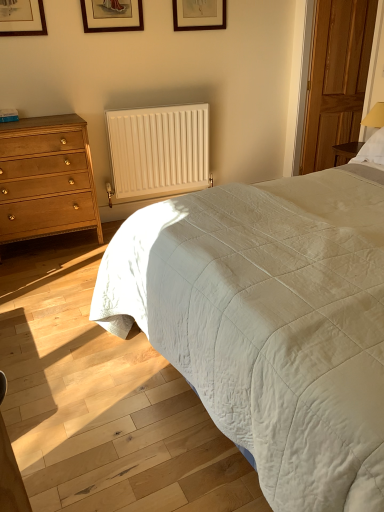
Question: Considering the relative positions of wooden picture frame at upper center, the second picture frame from the front, and wooden picture frame at upper center, which is the 1th picture frame from left to right, in the image provided, is wooden picture frame at upper center, the second picture frame from the front, to the right of wooden picture frame at upper center, which is the 1th picture frame from left to right, from the viewer's perspective?

Choices:
 (A) no
 (B) yes

Answer: (B)

Question: Is wooden picture frame at upper center, which is counted as the 1th picture frame, starting from the right, completely or partially outside of wooden picture frame at upper center, placed as the second picture frame when sorted from right to left?

Choices:
 (A) no
 (B) yes

Answer: (B)

Question: Does wooden picture frame at upper center, which ranks as the 1th picture frame in back-to-front order, have a greater width compared to wooden picture frame at upper center, placed as the second picture frame when sorted from right to left?

Choices:
 (A) no
 (B) yes

Answer: (B)

Question: Is there a large distance between wooden picture frame at upper center, which is counted as the 1th picture frame, starting from the right, and wooden picture frame at upper center, placed as the second picture frame when sorted from right to left?

Choices:
 (A) yes
 (B) no

Answer: (B)

Question: Does wooden picture frame at upper center, which is counted as the 1th picture frame, starting from the right, appear on the left side of wooden picture frame at upper center, which is the 1th picture frame from left to right?

Choices:
 (A) no
 (B) yes

Answer: (A)

Question: Is wooden door at right taller or shorter than white matte radiator at center?

Choices:
 (A) tall
 (B) short

Answer: (A)

Question: Is wooden door at right in front of or behind white matte radiator at center in the image?

Choices:
 (A) front
 (B) behind

Answer: (B)

Question: Considering the positions of point (324, 31) and point (145, 184), is point (324, 31) closer or farther from the camera than point (145, 184)?

Choices:
 (A) farther
 (B) closer

Answer: (B)

Question: From a real-world perspective, is wooden door at right above or below white matte radiator at center?

Choices:
 (A) below
 (B) above

Answer: (B)

Question: From the image's perspective, is wooden picture frame at upper center, acting as the second picture frame starting from the left, located above or below wooden door at right?

Choices:
 (A) above
 (B) below

Answer: (A)

Question: Based on their sizes in the image, would you say wooden picture frame at upper center, acting as the second picture frame starting from the left, is bigger or smaller than wooden door at right?

Choices:
 (A) small
 (B) big

Answer: (A)

Question: Is wooden picture frame at upper center, the second picture frame from the front, wider or thinner than wooden door at right?

Choices:
 (A) thin
 (B) wide

Answer: (A)

Question: Is wooden picture frame at upper center, acting as the second picture frame starting from the left, taller or shorter than wooden door at right?

Choices:
 (A) short
 (B) tall

Answer: (A)

Question: Is white quilted bed at right wider or thinner than wooden door at right?

Choices:
 (A) wide
 (B) thin

Answer: (A)

Question: In terms of height, does white quilted bed at right look taller or shorter compared to wooden door at right?

Choices:
 (A) tall
 (B) short

Answer: (B)